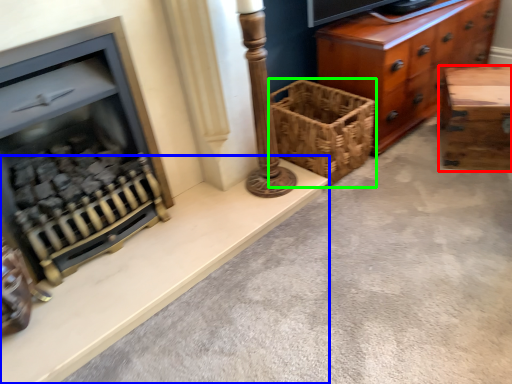
Question: Which object is the closest to the table (highlighted by a red box)? Choose among these: ledge (highlighted by a blue box) or basket (highlighted by a green box).

Choices:
 (A) ledge
 (B) basket

Answer: (B)